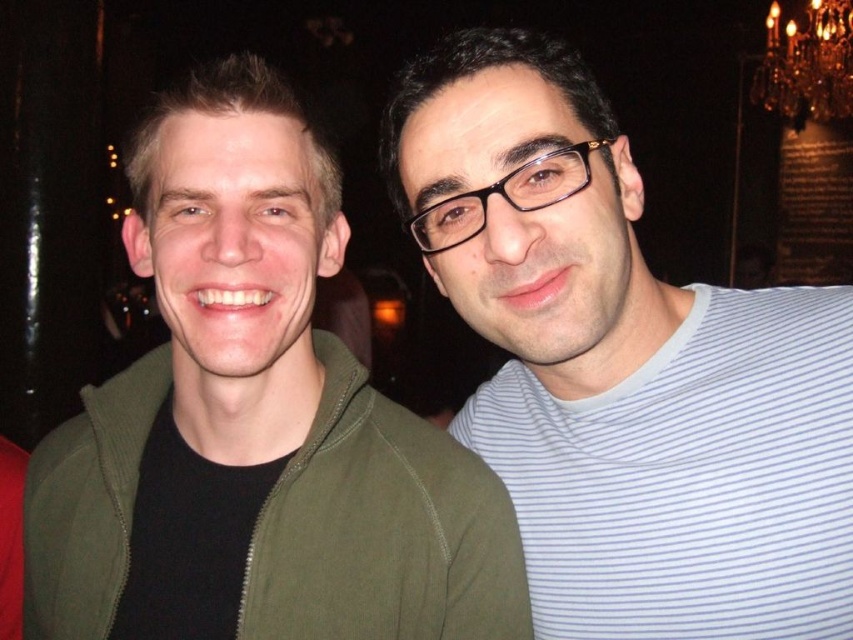
From the picture: Between green matte jacket at left and white striped t-shirt at right, which one appears on the left side from the viewer's perspective?

Positioned to the left is green matte jacket at left.

Does point (345, 397) lie behind point (515, 412)?

No, (345, 397) is closer to viewer.

This screenshot has height=640, width=853. In order to click on green matte jacket at left in this screenshot , I will do `click(254, 424)`.

The image size is (853, 640). What are the coordinates of `green matte jacket at left` in the screenshot? It's located at click(254, 424).

What do you see at coordinates (624, 369) in the screenshot? This screenshot has width=853, height=640. I see `striped cotton shirt at right` at bounding box center [624, 369].

What do you see at coordinates (624, 369) in the screenshot? I see `striped cotton shirt at right` at bounding box center [624, 369].

This screenshot has width=853, height=640. In order to click on striped cotton shirt at right in this screenshot , I will do `click(624, 369)`.

Which of these two, green matte jacket at left or gold crystal chandelier at upper right, stands shorter?

With less height is gold crystal chandelier at upper right.

Which is more to the right, green matte jacket at left or gold crystal chandelier at upper right?

From the viewer's perspective, gold crystal chandelier at upper right appears more on the right side.

In order to click on green matte jacket at left in this screenshot , I will do `click(254, 424)`.